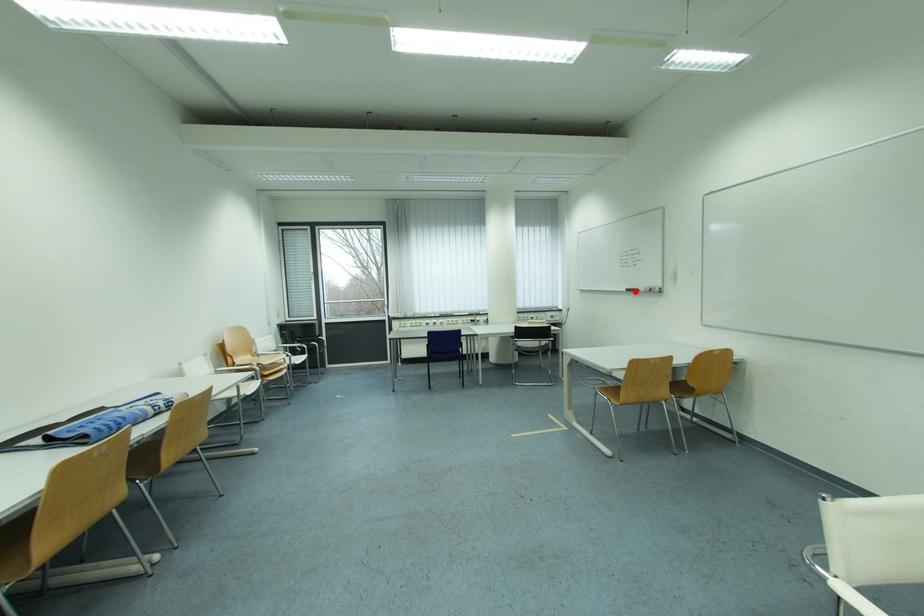
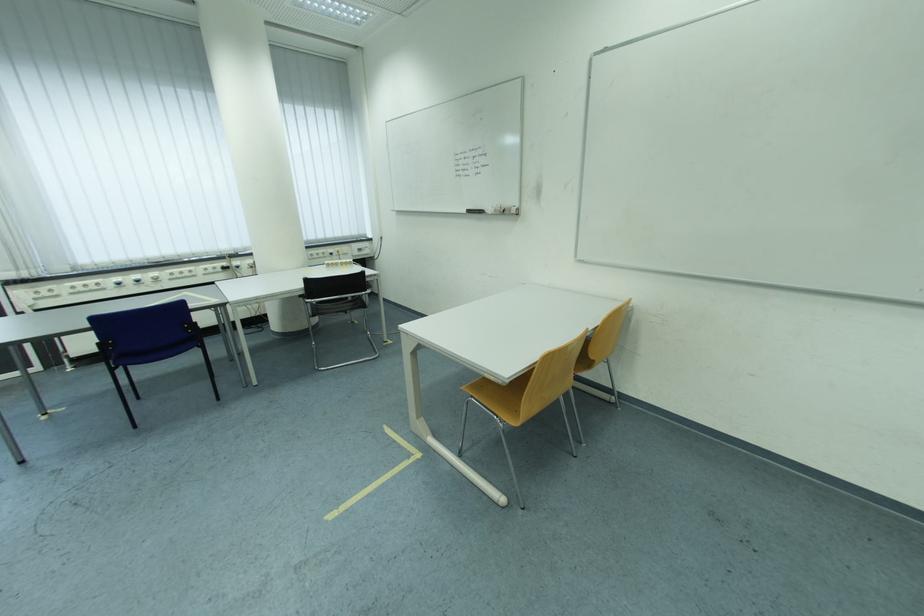
Locate, in the second image, the point that corresponds to the highlighted location in the first image.

(476, 213)